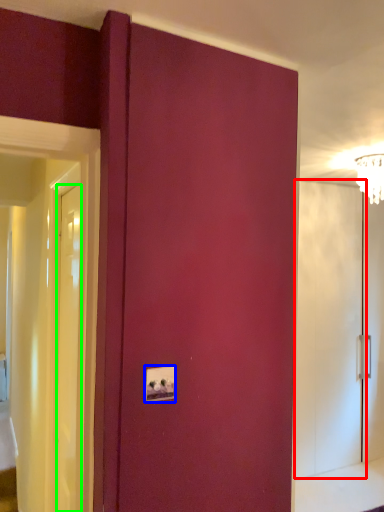
Question: Considering the real-world distances, which object is closest to screen door (highlighted by a red box)? light switch (highlighted by a blue box) or door (highlighted by a green box).

Choices:
 (A) light switch
 (B) door

Answer: (B)